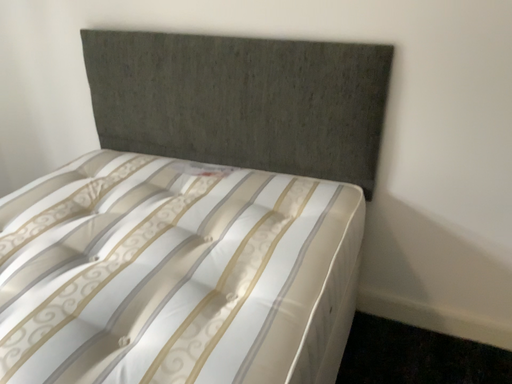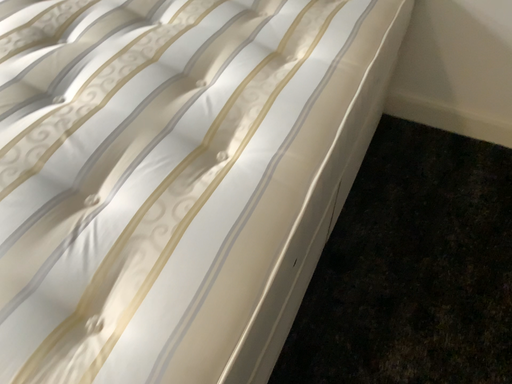
Question: How did the camera likely rotate when shooting the video?

Choices:
 (A) rotated upward
 (B) rotated downward

Answer: (B)